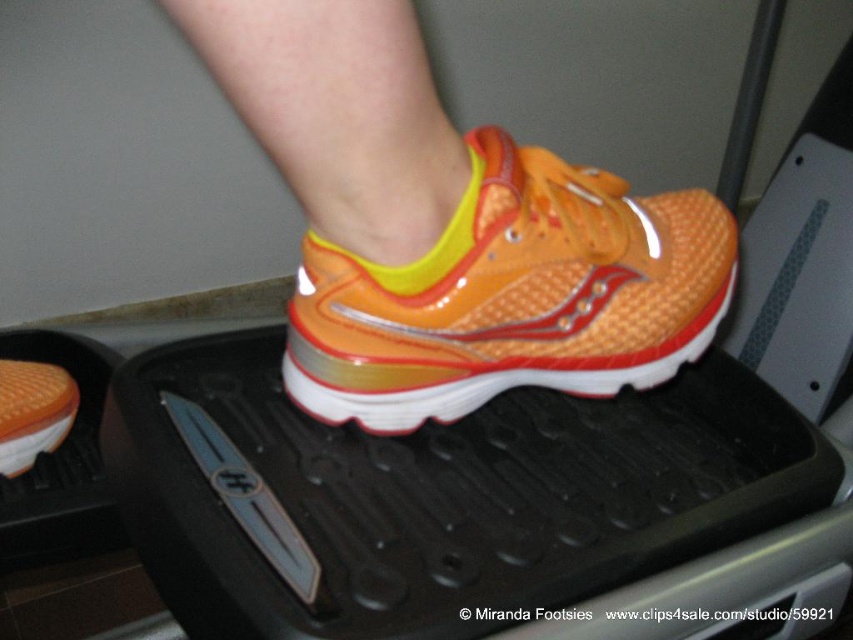
Question: Which point is farther from the camera taking this photo?

Choices:
 (A) (21, 396)
 (B) (436, 312)

Answer: (A)

Question: Does orange glossy running shoe at center appear on the left side of orange rubber shoe at center?

Choices:
 (A) no
 (B) yes

Answer: (A)

Question: Which point appears closest to the camera in this image?

Choices:
 (A) (593, 205)
 (B) (33, 376)

Answer: (A)

Question: Is orange glossy running shoe at center to the left of orange rubber shoe at center from the viewer's perspective?

Choices:
 (A) no
 (B) yes

Answer: (A)

Question: Is orange glossy running shoe at center above orange rubber shoe at center?

Choices:
 (A) yes
 (B) no

Answer: (A)